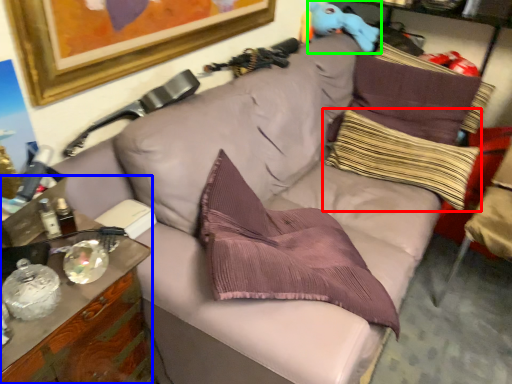
Question: Estimate the real-world distances between objects in this image. Which object is closer to pillow (highlighted by a red box), cabinetry (highlighted by a blue box) or toy (highlighted by a green box)?

Choices:
 (A) cabinetry
 (B) toy

Answer: (B)